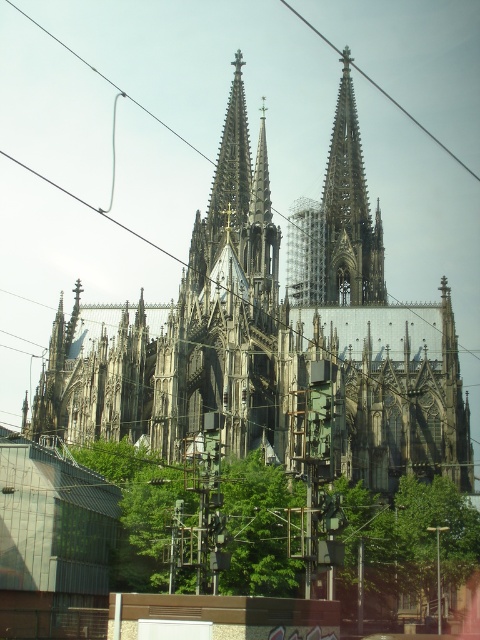
Question: Which object appears closest to the camera in this image?

Choices:
 (A) gray stone spire at center
 (B) metallic wire at upper center

Answer: (A)

Question: Is gray stone spire at center to the right of metallic wire at upper center from the viewer's perspective?

Choices:
 (A) yes
 (B) no

Answer: (B)

Question: Among these objects, which one is nearest to the camera?

Choices:
 (A) metallic wire at upper center
 (B) gray stone spire at center

Answer: (B)

Question: Is dark gray stone church at center closer to camera compared to gray stone spire at center?

Choices:
 (A) no
 (B) yes

Answer: (B)

Question: Does dark gray stone church at center have a lesser width compared to gray stone spire at center?

Choices:
 (A) no
 (B) yes

Answer: (A)

Question: Which of these objects is positioned closest to the dark gray stone church at center?

Choices:
 (A) gray stone spire at center
 (B) metallic wire at upper center

Answer: (A)